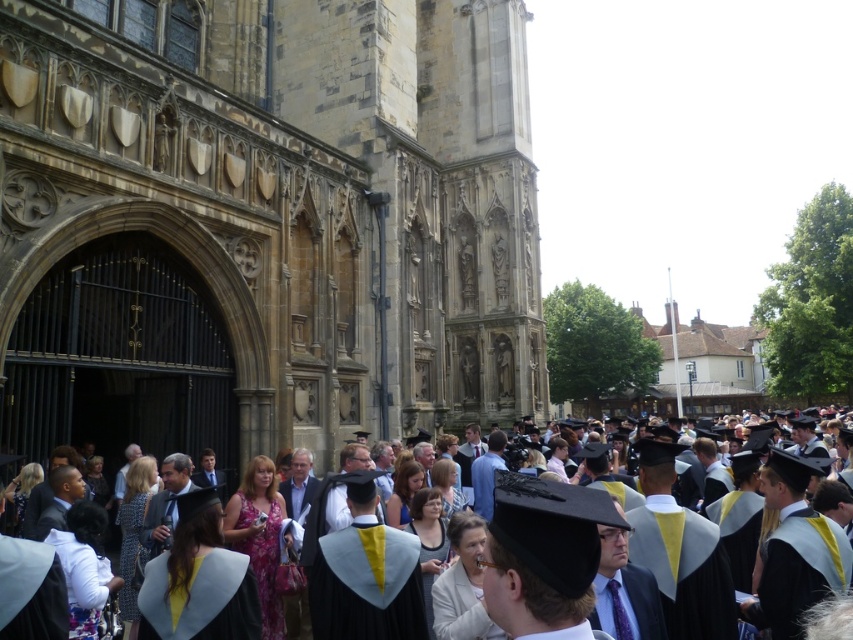
You are a photographer standing at the back of the crowd. You want to take a photo of both the matte black graduation gown at center and the light blue felt graduation gown at lower center. Which one should you ask to move forward so that both are fully visible in the photo?

The matte black graduation gown at center is in front of the light blue felt graduation gown at lower center. To ensure both are fully visible, you should ask the light blue felt graduation gown at lower center to move forward so it is no longer blocked by the matte black one.

You are a photographer at the graduation ceremony and want to capture a photo that includes both the brown stone church at center and the matte black graduation gown at center. Based on their positions, which object should you place on the left side of your camera frame?

The brown stone church at center is positioned on the left side of matte black graduation gown at center, so you should place the brown stone church at center on the left side of your camera frame.

You are standing at the entrance of the graduation ceremony venue. You want to take a photo of the brown stone church at center. Where should you position yourself to ensure the church is centered in your camera frame?

Since the 2D location of the brown stone church at center is at point [264,224], you should position yourself slightly to the left and lower side to center it in your camera frame.